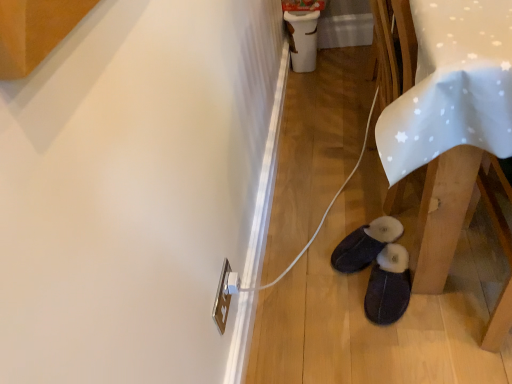
Question: Is dark gray suede slippers at lower center, the 1th footwear when ordered from front to back, smaller than white fabric table at lower right?

Choices:
 (A) yes
 (B) no

Answer: (A)

Question: Does dark gray suede slippers at lower center, the 1th footwear when ordered from front to back, have a lesser width compared to white fabric table at lower right?

Choices:
 (A) yes
 (B) no

Answer: (A)

Question: Is dark gray suede slippers at lower center, arranged as the 2th footwear when viewed from the back, behind white fabric table at lower right?

Choices:
 (A) no
 (B) yes

Answer: (B)

Question: From the image's perspective, is dark gray suede slippers at lower center, the 1th footwear when ordered from front to back, beneath white fabric table at lower right?

Choices:
 (A) yes
 (B) no

Answer: (A)

Question: Considering the relative positions of dark gray suede slippers at lower center, arranged as the 2th footwear when viewed from the back, and white fabric table at lower right in the image provided, is dark gray suede slippers at lower center, arranged as the 2th footwear when viewed from the back, to the right of white fabric table at lower right from the viewer's perspective?

Choices:
 (A) no
 (B) yes

Answer: (A)

Question: Could you tell me if dark gray suede slippers at lower center, the 1th footwear when ordered from front to back, is turned towards white fabric table at lower right?

Choices:
 (A) no
 (B) yes

Answer: (B)

Question: Does white fabric table at lower right have a smaller size compared to dark gray suede slippers at lower center, arranged as the 2th footwear when viewed from the back?

Choices:
 (A) no
 (B) yes

Answer: (A)

Question: From a real-world perspective, does white fabric table at lower right stand above dark gray suede slippers at lower center, arranged as the 2th footwear when viewed from the back?

Choices:
 (A) no
 (B) yes

Answer: (B)

Question: Would you say white fabric table at lower right is outside dark gray suede slippers at lower center, arranged as the 2th footwear when viewed from the back?

Choices:
 (A) no
 (B) yes

Answer: (B)

Question: Is the surface of white fabric table at lower right in direct contact with dark gray suede slippers at lower center, the 1th footwear when ordered from front to back?

Choices:
 (A) yes
 (B) no

Answer: (B)

Question: Would you say white fabric table at lower right contains dark gray suede slippers at lower center, the 1th footwear when ordered from front to back?

Choices:
 (A) no
 (B) yes

Answer: (B)

Question: Does white fabric table at lower right appear on the right side of dark gray suede slippers at lower center, arranged as the 2th footwear when viewed from the back?

Choices:
 (A) yes
 (B) no

Answer: (A)

Question: Is dark suede slippers at lower center, the 1th footwear from the back, taller than dark gray suede slippers at lower center, arranged as the 2th footwear when viewed from the back?

Choices:
 (A) yes
 (B) no

Answer: (B)